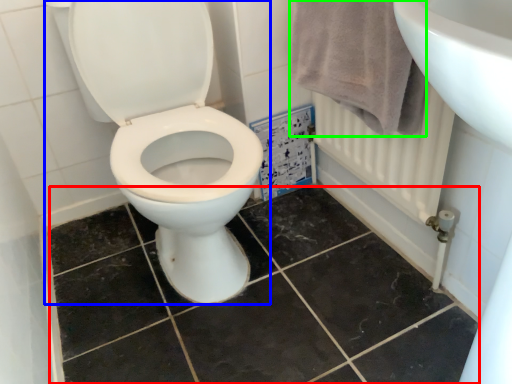
Question: Considering the real-world distances, which object is farthest from ceramic tile (highlighted by a red box)? toilet (highlighted by a blue box) or bath towel (highlighted by a green box)?

Choices:
 (A) toilet
 (B) bath towel

Answer: (B)